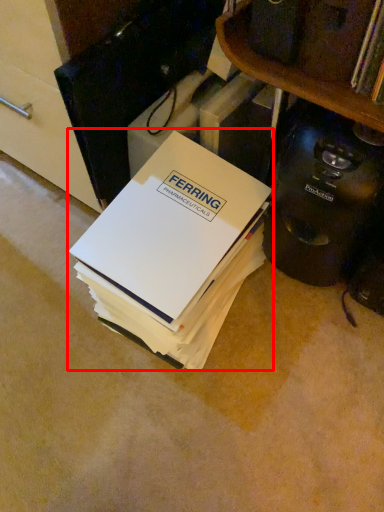
Question: From the image's perspective, where is paperback book (annotated by the red box) located in relation to home appliance in the image?

Choices:
 (A) below
 (B) above

Answer: (A)